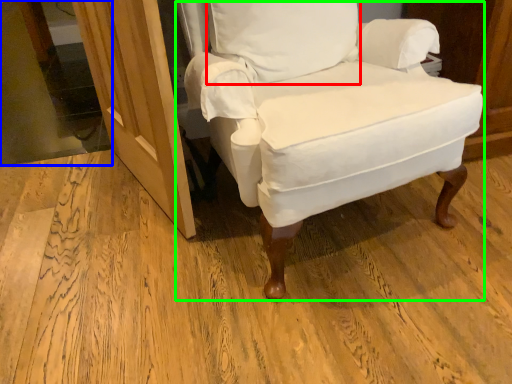
Question: Which is farther away from pillow (highlighted by a red box)? glass door (highlighted by a blue box) or chair (highlighted by a green box)?

Choices:
 (A) glass door
 (B) chair

Answer: (A)